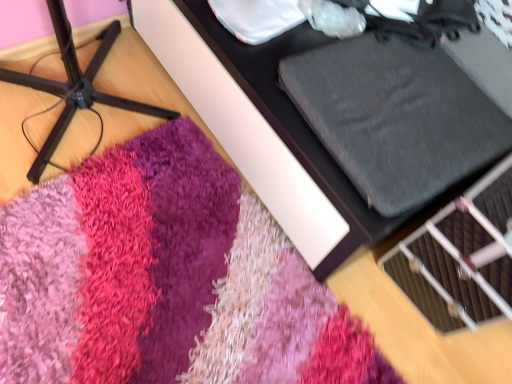
This screenshot has height=384, width=512. What are the coordinates of `vacant space in shaggy carpet at lower left, the 1th furniture positioned from the left (from a real-world perspective)` in the screenshot? It's located at (93, 107).